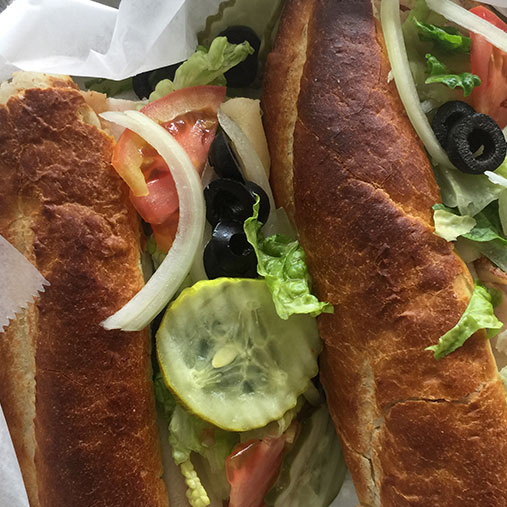
You are a GUI agent. You are given a task and a screenshot of the screen. Output one action in this format:
    pyautogui.click(x=<x>, y=<y>)
    Task: Click on the baking paper
    This screenshot has width=507, height=507.
    Given the screenshot: What is the action you would take?
    pyautogui.click(x=28, y=281), pyautogui.click(x=1, y=481), pyautogui.click(x=50, y=22), pyautogui.click(x=152, y=21)